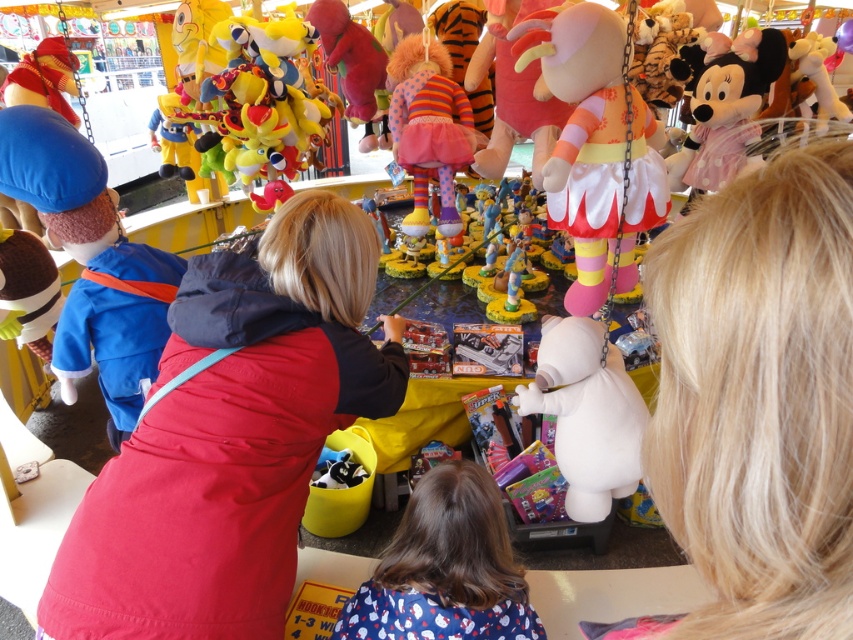
You are at the fairground and want to grab the closest toy to you using the claw machine. The claw can only pick up toys that are smaller than the claw itself. Given that the claw can hold the striped fabric clown at center, can it also pick up the matte red plush toy at left?

The striped fabric clown at center is smaller than the matte red plush toy at left. Since the claw can hold the striped fabric clown at center, it might not be able to pick up the matte red plush toy at left if it is larger than the claw.

You are at a carnival and want to grab a prize from the claw machine. You see the matte pink plush at upper right and the striped fabric clown at center. Which one do you think is easier to grab with the claw, and why?

The matte pink plush at upper right is larger in size compared to the striped fabric clown at center, so it might be easier to grab with the claw because larger objects are generally easier to grasp.